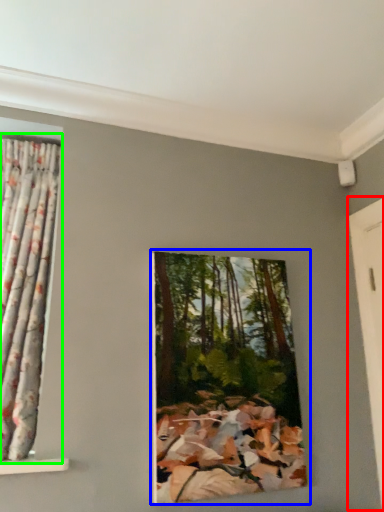
Question: Which object is positioned closest to door (highlighted by a red box)? Select from oil painting (highlighted by a blue box) and curtain (highlighted by a green box).

Choices:
 (A) oil painting
 (B) curtain

Answer: (A)